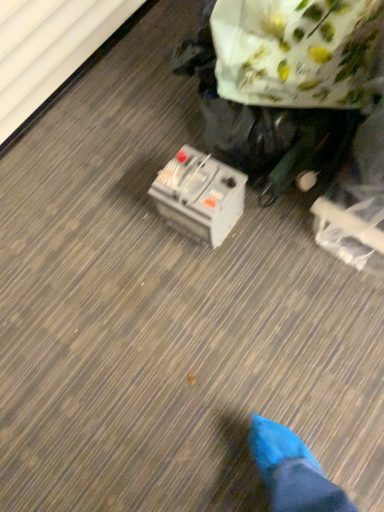
You are a GUI agent. You are given a task and a screenshot of the screen. Output one action in this format:
    pyautogui.click(x=<x>, y=<y>)
    Task: Click on the empty space that is to the right of gray plastic battery at center
    The width and height of the screenshot is (384, 512).
    Given the screenshot: What is the action you would take?
    pyautogui.click(x=268, y=212)